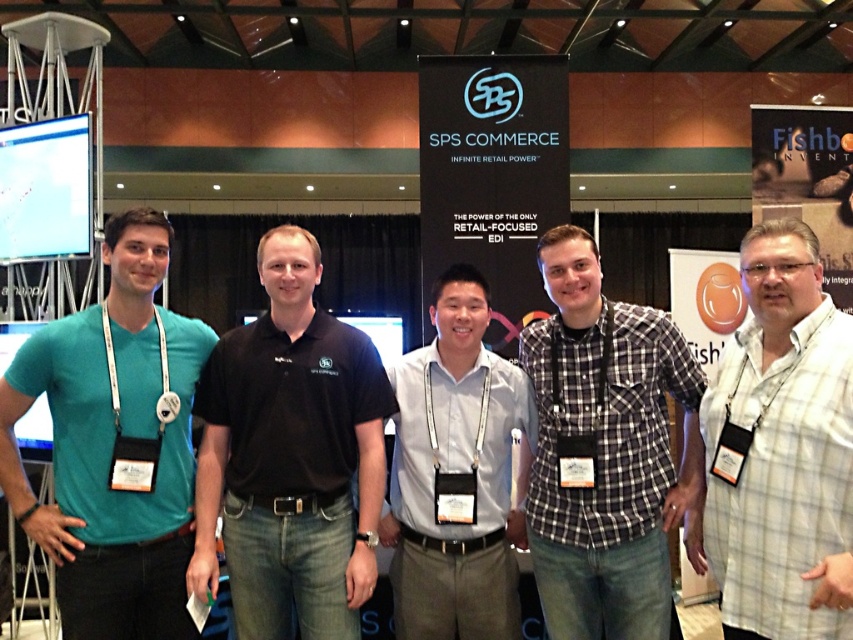
How distant is teal matte t-shirt at left from white checkered shirt at center?

teal matte t-shirt at left is 1.70 meters from white checkered shirt at center.

Measure the distance from teal matte t-shirt at left to white checkered shirt at center.

teal matte t-shirt at left and white checkered shirt at center are 1.70 meters apart.

This screenshot has width=853, height=640. What are the coordinates of `teal matte t-shirt at left` in the screenshot? It's located at (113, 444).

Is the position of black cotton polo shirt at center more distant than that of teal matte t-shirt at left?

Yes, black cotton polo shirt at center is behind teal matte t-shirt at left.

Is black cotton polo shirt at center closer to camera compared to teal matte t-shirt at left?

No, it is behind teal matte t-shirt at left.

This screenshot has width=853, height=640. What do you see at coordinates (289, 458) in the screenshot?
I see `black cotton polo shirt at center` at bounding box center [289, 458].

Locate an element on the screen. black cotton polo shirt at center is located at coordinates (289, 458).

Can you confirm if checkered fabric shirt at center is thinner than light gray shirt at center?

In fact, checkered fabric shirt at center might be wider than light gray shirt at center.

Does checkered fabric shirt at center have a lesser height compared to light gray shirt at center?

No.

Who is more distant from viewer, (x=558, y=532) or (x=509, y=628)?

The point (x=509, y=628) is behind.

Image resolution: width=853 pixels, height=640 pixels. I want to click on checkered fabric shirt at center, so click(x=604, y=451).